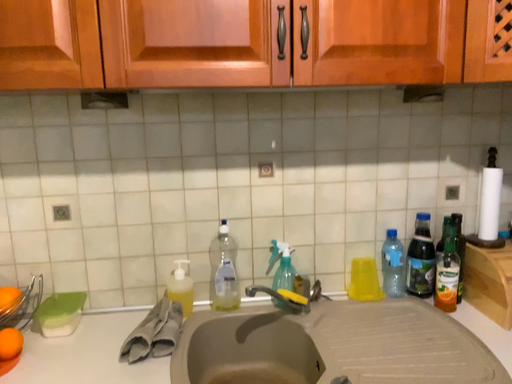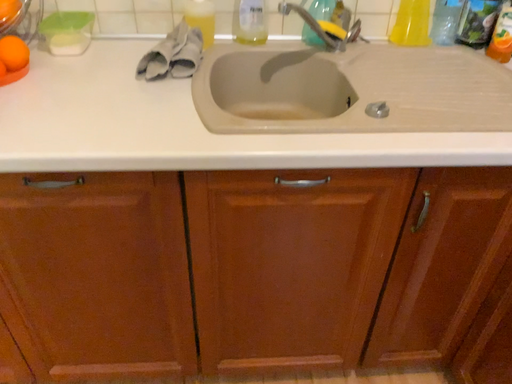
Question: How did the camera likely rotate when shooting the video?

Choices:
 (A) rotated downward
 (B) rotated upward

Answer: (A)